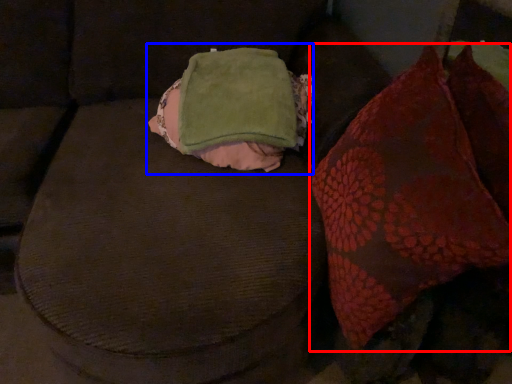
Question: Which of the following is the closest to the observer, throw pillow (highlighted by a red box) or bean bag chair (highlighted by a blue box)?

Choices:
 (A) throw pillow
 (B) bean bag chair

Answer: (A)